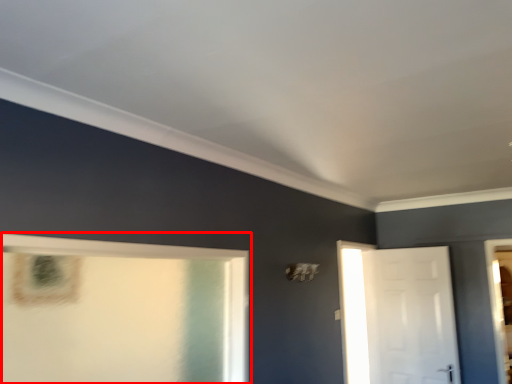
Question: From the image's perspective, considering the relative positions of window (annotated by the red box) and door in the image provided, where is window (annotated by the red box) located with respect to the staircase?

Choices:
 (A) above
 (B) below

Answer: (A)